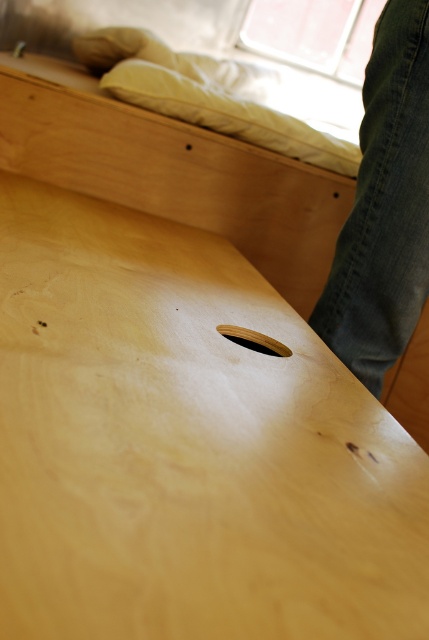
Does point (184, 228) come farther from viewer compared to point (325, 330)?

Yes, point (184, 228) is farther from viewer.

Where is `natural wood plywood at center`? This screenshot has width=429, height=640. natural wood plywood at center is located at coordinates (186, 445).

Measure the distance between natural wood plywood at center and camera.

11.00 inches

This screenshot has width=429, height=640. I want to click on natural wood plywood at center, so click(x=186, y=445).

Between point (123, 509) and point (410, 144), which one is positioned in front?

Point (123, 509) is more forward.

Does natural wood plywood at center have a lesser width compared to dark blue jeans at right?

In fact, natural wood plywood at center might be wider than dark blue jeans at right.

Identify the location of natural wood plywood at center. (186, 445).

Does natural wood bed at center appear on the right side of wooden hole at center?

Correct, you'll find natural wood bed at center to the right of wooden hole at center.

Is natural wood bed at center wider than wooden hole at center?

Indeed, natural wood bed at center has a greater width compared to wooden hole at center.

Which is behind, point (320, 332) or point (238, 336)?

The point (320, 332) is more distant.

Find the location of a particular element. natural wood bed at center is located at coordinates (383, 211).